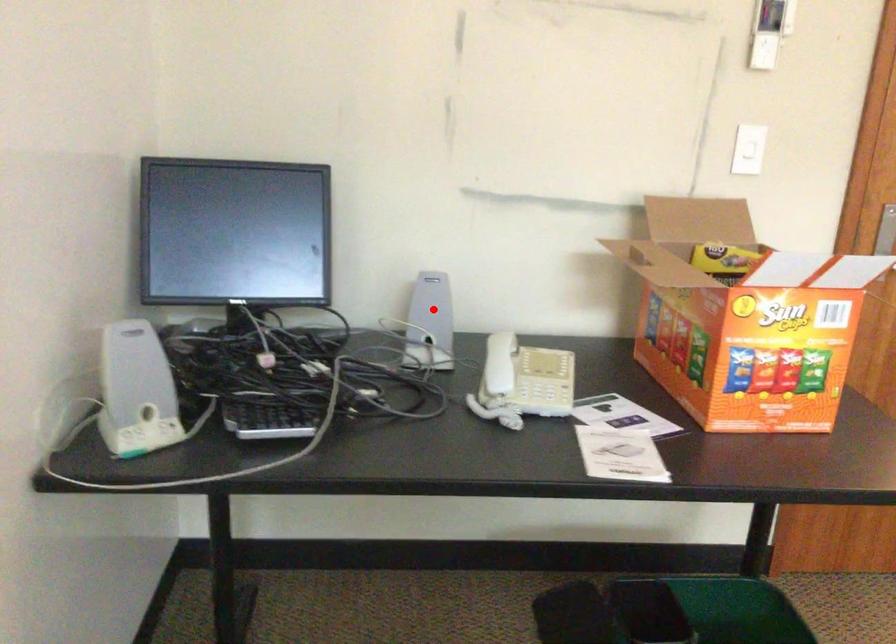
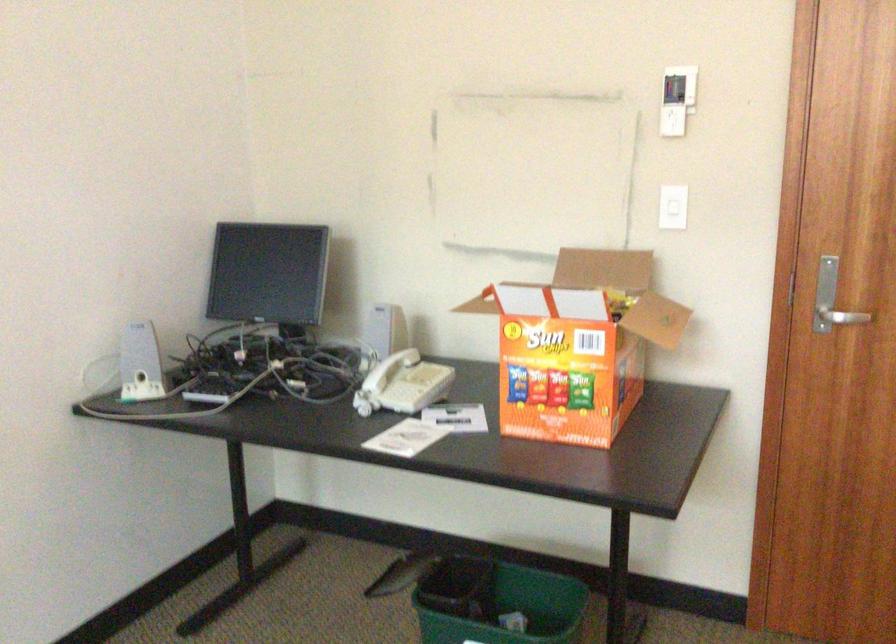
Question: A red point is marked in image1. In image2, is the corresponding 3D point closer to the camera or farther? Reply with the corresponding letter.

Choices:
 (A) The corresponding 3D point is closer.
 (B) The corresponding 3D point is farther.

Answer: (B)